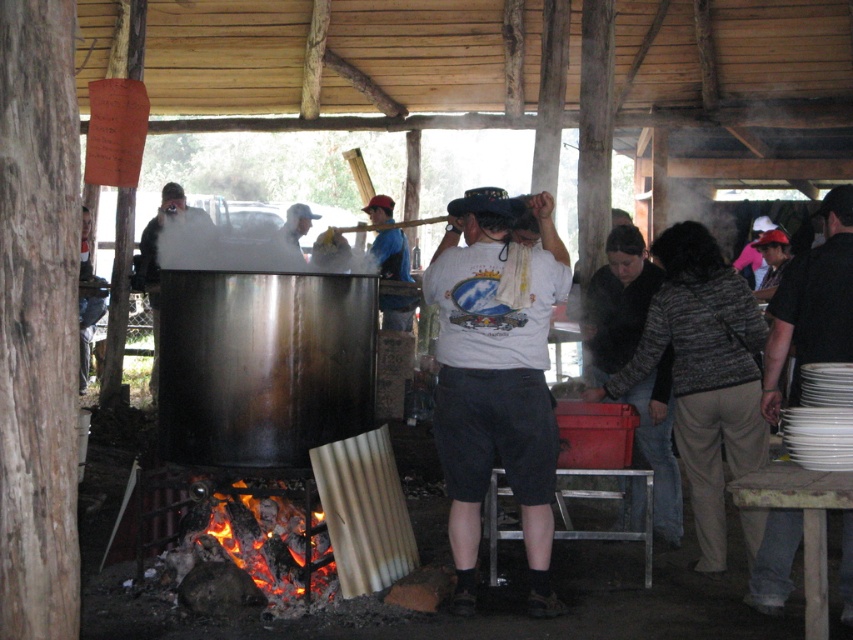
Question: Which object is positioned farthest from the charcoal wood fire at lower left?

Choices:
 (A) black fabric shirt at right
 (B) white t-shirt at center

Answer: (A)

Question: Considering the relative positions of black fabric shirt at right and charcoal wood fire at lower left in the image provided, where is black fabric shirt at right located with respect to charcoal wood fire at lower left?

Choices:
 (A) right
 (B) left

Answer: (A)

Question: Estimate the real-world distances between objects in this image. Which object is closer to the black fabric shirt at right?

Choices:
 (A) white t-shirt at center
 (B) charcoal wood fire at lower left

Answer: (A)

Question: Does white t-shirt at center appear on the right side of black fabric shirt at right?

Choices:
 (A) no
 (B) yes

Answer: (A)

Question: Can you confirm if white t-shirt at center is positioned to the left of black fabric shirt at right?

Choices:
 (A) no
 (B) yes

Answer: (B)

Question: Based on their relative distances, which object is nearer to the white t-shirt at center?

Choices:
 (A) black fabric shirt at right
 (B) charcoal wood fire at lower left

Answer: (B)